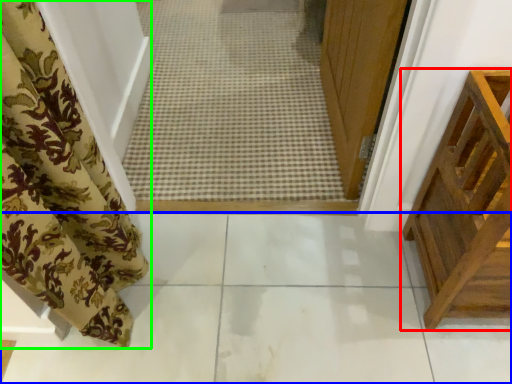
Question: Which object is positioned farthest from furniture (highlighted by a red box)? Select from path (highlighted by a blue box) and curtain (highlighted by a green box).

Choices:
 (A) path
 (B) curtain

Answer: (B)